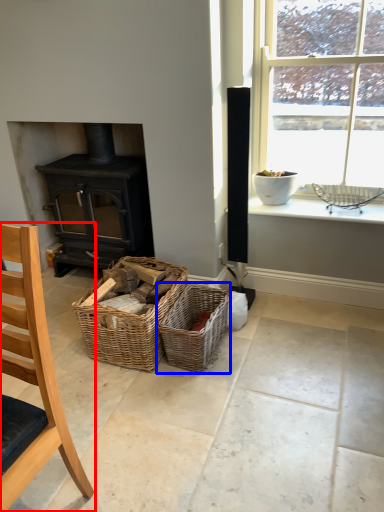
Question: Among these objects, which one is nearest to the camera, chair (highlighted by a red box) or picnic basket (highlighted by a blue box)?

Choices:
 (A) chair
 (B) picnic basket

Answer: (A)